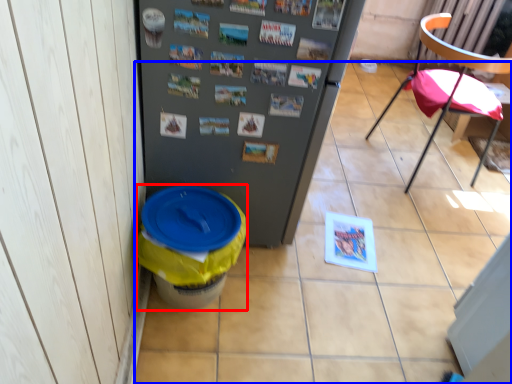
Question: Which point is further to the camera, potty (highlighted by a red box) or tile (highlighted by a blue box)?

Choices:
 (A) potty
 (B) tile

Answer: (B)